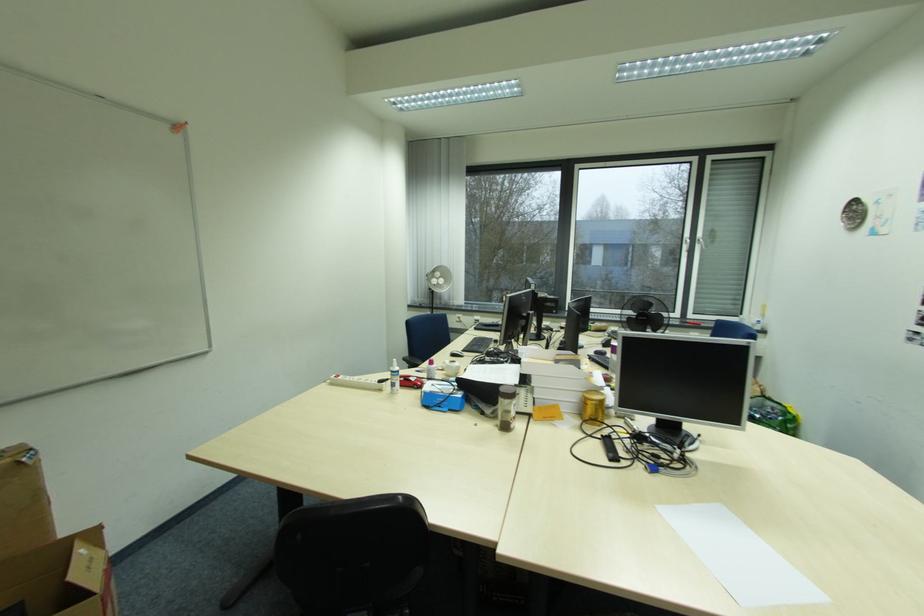
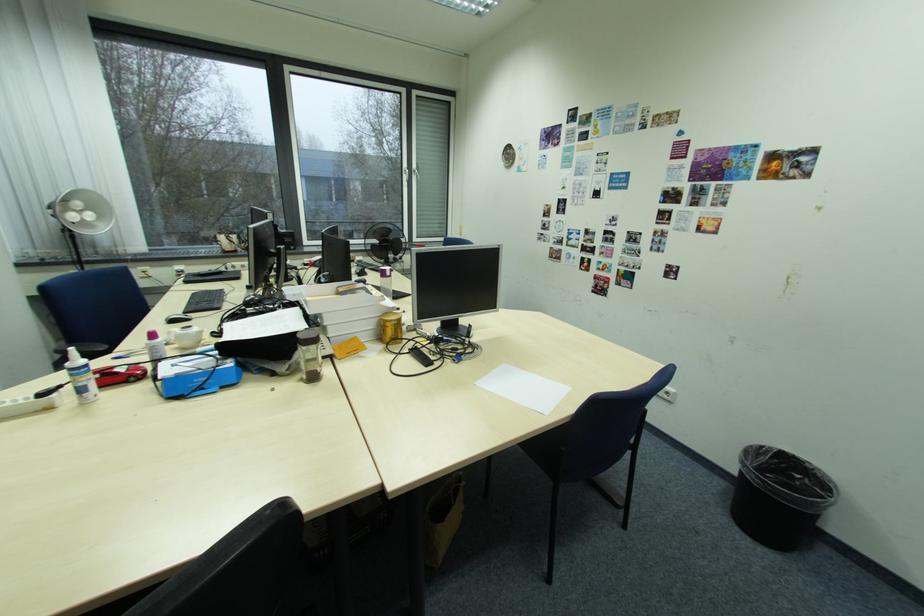
In the second image, find the point that corresponds to pixel 405 374 in the first image.

(94, 370)